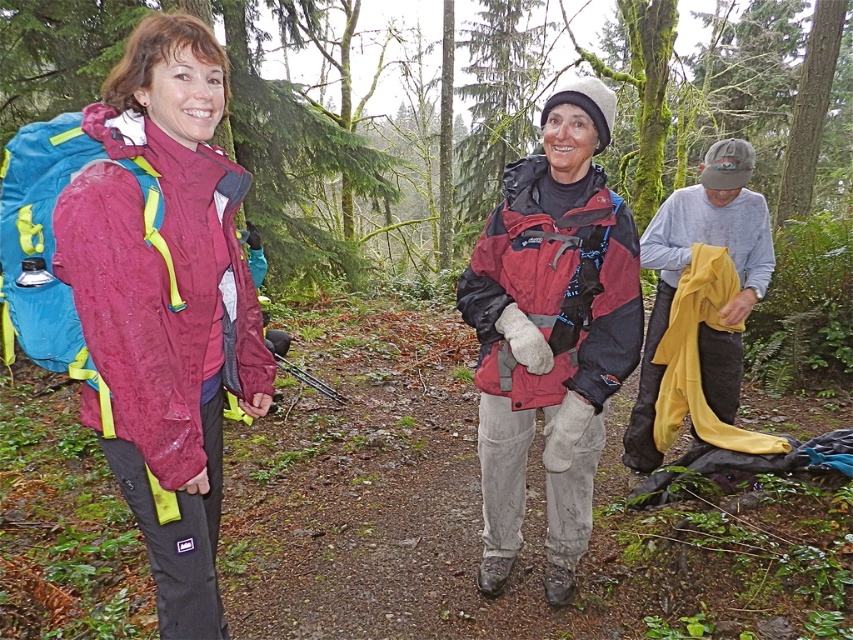
Based on the scene description, which object is located at the coordinates point (166, 301)?

The point (166, 301) corresponds to the wet matte jacket at left.

You are a photographer standing in front of the camera. You want to take a closeup shot of the wet matte jacket at left without moving your position. Can you do it with a standard lens that has a maximum focal length of 50mm? Explain why or why not.

The wet matte jacket at left is 1.50 meters from the camera. With a standard lens of 50mm, you can take a closeup shot without moving because the distance is within the lens capability.